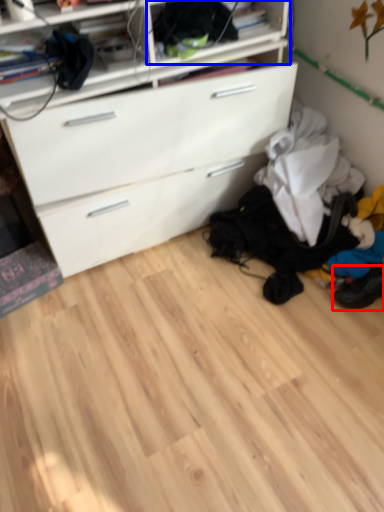
Question: Which object is closer to the camera taking this photo, footwear (highlighted by a red box) or shelf (highlighted by a blue box)?

Choices:
 (A) footwear
 (B) shelf

Answer: (B)